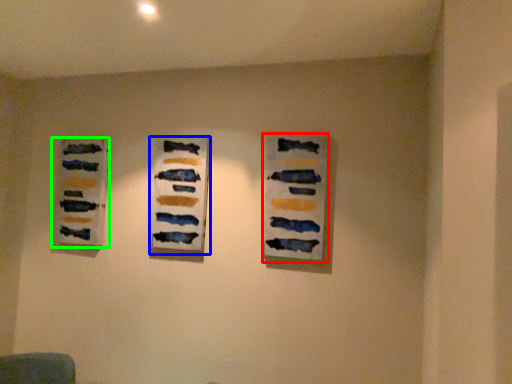
Question: Estimate the real-world distances between objects in this image. Which object is closer to art exhibition (highlighted by a red box), art exhibition (highlighted by a blue box) or art exhibition (highlighted by a green box)?

Choices:
 (A) art exhibition
 (B) art exhibition

Answer: (A)